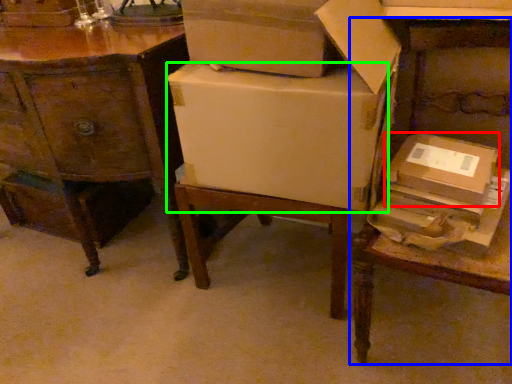
Question: Which is farther away from cardboard box (highlighted by a red box)? table (highlighted by a blue box) or cardboard box (highlighted by a green box)?

Choices:
 (A) table
 (B) cardboard box

Answer: (B)